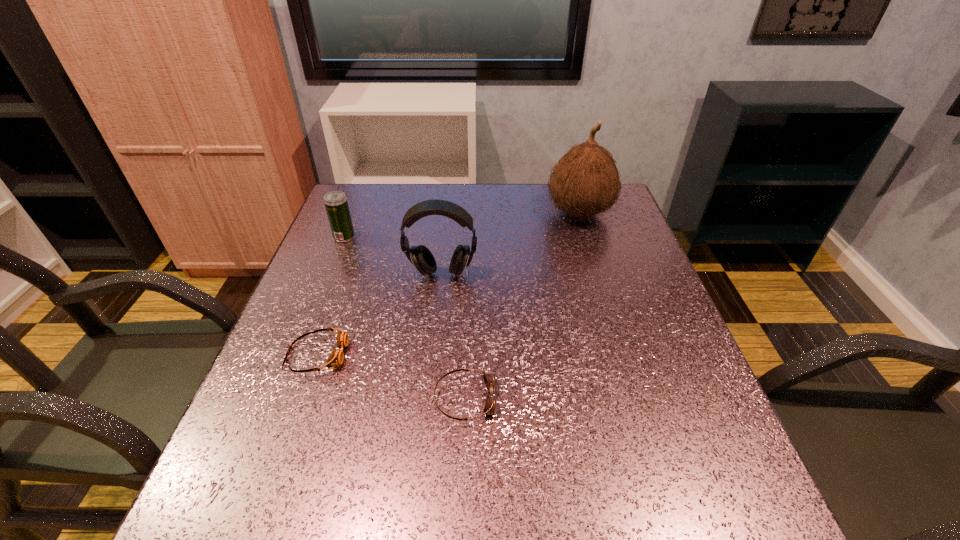
You are a GUI agent. You are given a task and a screenshot of the screen. Output one action in this format:
    pyautogui.click(x=<x>, y=<y>)
    Task: Click on the coconut
    The width and height of the screenshot is (960, 540).
    Given the screenshot: What is the action you would take?
    pyautogui.click(x=585, y=182)

At what (x,y) coordinates should I click in order to perform the action: click on the tallest object. Please return your answer as a coordinate pair (x, y). Looking at the image, I should click on (585, 182).

Where is `the second tallest object`? the second tallest object is located at coordinates (420, 256).

The image size is (960, 540). In order to click on earphone in this screenshot , I will do `click(420, 256)`.

In order to click on beer can in this screenshot , I will do `click(336, 204)`.

The width and height of the screenshot is (960, 540). In order to click on the left goggles in this screenshot , I will do `click(336, 358)`.

Find the location of a particular element. The image size is (960, 540). the right goggles is located at coordinates (490, 407).

Locate an element on the screen. Image resolution: width=960 pixels, height=540 pixels. vacant space located on the surface of the rightmost object is located at coordinates (489, 213).

This screenshot has height=540, width=960. I want to click on vacant space located 0.320m on the surface of the rightmost object, so click(x=434, y=213).

This screenshot has width=960, height=540. What are the coordinates of `vacant region located on the surface of the rightmost object` in the screenshot? It's located at (430, 213).